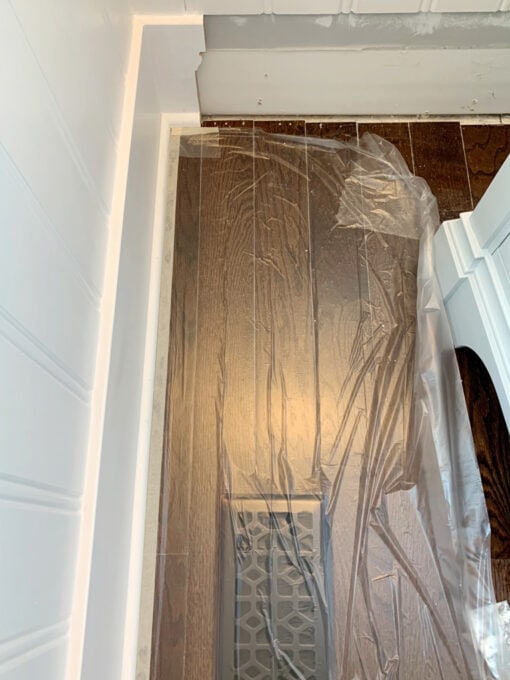
This screenshot has height=680, width=510. I want to click on wood grain lines, so click(x=481, y=147), click(x=482, y=170), click(x=235, y=218), click(x=252, y=634), click(x=170, y=627), click(x=183, y=675), click(x=491, y=471), click(x=288, y=255), click(x=342, y=335).